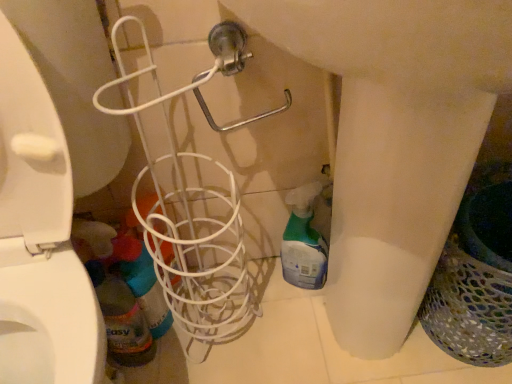
In order to face metallic silver shower at upper center, should I rotate leftwards or rightwards?

To face it directly, rotate left by 2.031 degrees.

The height and width of the screenshot is (384, 512). What are the coordinates of `metallic silver shower at upper center` in the screenshot? It's located at (197, 74).

Locate an element on the screen. The image size is (512, 384). multicolored mesh laundry basket at right is located at coordinates (475, 282).

Describe the element at coordinates (303, 241) in the screenshot. This screenshot has height=384, width=512. I see `translucent plastic spray bottle at lower center, which is the first cleaning product from right to left` at that location.

Locate an element on the screen. translucent plastic spray bottle at lower left, the 2th cleaning product when ordered from right to left is located at coordinates (141, 281).

Locate an element on the screen. Image resolution: width=512 pixels, height=384 pixels. white wire basket at center is located at coordinates (394, 139).

The image size is (512, 384). What are the coordinates of `metallic silver shower at upper center` in the screenshot? It's located at (197, 74).

Which object is more forward, white wire basket at center or translucent plastic bottle at lower left?

Positioned in front is white wire basket at center.

Could translucent plastic bottle at lower left be considered to be inside white wire basket at center?

No, white wire basket at center does not contain translucent plastic bottle at lower left.

Is translucent plastic bottle at lower left at the back of white wire basket at center?

That's not correct — white wire basket at center is not looking away from translucent plastic bottle at lower left.

Is white wire basket at center in contact with translucent plastic bottle at lower left?

No, white wire basket at center is not touching translucent plastic bottle at lower left.

Is translucent plastic bottle at lower left turned away from translucent plastic spray bottle at lower left, the 2th cleaning product when ordered from right to left?

Yes, translucent plastic spray bottle at lower left, the 2th cleaning product when ordered from right to left, is at the back of translucent plastic bottle at lower left.

Can you confirm if translucent plastic bottle at lower left is positioned to the right of translucent plastic spray bottle at lower left, the 2th cleaning product when ordered from right to left?

Incorrect, translucent plastic bottle at lower left is not on the right side of translucent plastic spray bottle at lower left, the 2th cleaning product when ordered from right to left.

Which object is wider, translucent plastic bottle at lower left or translucent plastic spray bottle at lower left, the 2th cleaning product when ordered from right to left?

Wider between the two is translucent plastic spray bottle at lower left, the 2th cleaning product when ordered from right to left.

From a real-world perspective, who is located higher, translucent plastic bottle at lower left or translucent plastic spray bottle at lower left, the 2th cleaning product when ordered from right to left?

From a 3D spatial view, translucent plastic bottle at lower left is above.

Which point is more distant from viewer, [110,334] or [413,12]?

The point [110,334] is more distant.

The width and height of the screenshot is (512, 384). Find the location of `sink above the translucent plastic bottle at lower left (from the image's perspective)`. sink above the translucent plastic bottle at lower left (from the image's perspective) is located at coordinates (394, 139).

Is translucent plastic bottle at lower left directly adjacent to white wire basket at center?

translucent plastic bottle at lower left and white wire basket at center are clearly separated.

Considering the sizes of objects translucent plastic bottle at lower left and white wire basket at center in the image provided, who is wider, translucent plastic bottle at lower left or white wire basket at center?

white wire basket at center is wider.

Between translucent plastic bottle at lower left and multicolored mesh laundry basket at right, which one has larger size?

multicolored mesh laundry basket at right is bigger.

Is translucent plastic bottle at lower left wider or thinner than multicolored mesh laundry basket at right?

Clearly, translucent plastic bottle at lower left has less width compared to multicolored mesh laundry basket at right.

Identify the location of laundry basket that appears in front of the translucent plastic bottle at lower left. [x=475, y=282].

In the scene shown: From the image's perspective, is translucent plastic bottle at lower left on multicolored mesh laundry basket at right?

No, from the image's perspective, translucent plastic bottle at lower left is not on top of multicolored mesh laundry basket at right.

In the image, is white wire basket at center on the left side or the right side of multicolored mesh laundry basket at right?

Based on their positions, white wire basket at center is located to the left of multicolored mesh laundry basket at right.

Is the surface of white wire basket at center in direct contact with multicolored mesh laundry basket at right?

No, white wire basket at center is not in contact with multicolored mesh laundry basket at right.

Which object is thinner, white wire basket at center or multicolored mesh laundry basket at right?

With smaller width is multicolored mesh laundry basket at right.

Find the location of `sink above the multicolored mesh laundry basket at right (from a real-world perspective)`. sink above the multicolored mesh laundry basket at right (from a real-world perspective) is located at coordinates (394, 139).

From the image's perspective, is translucent plastic spray bottle at lower left, the 1th cleaning product in the left-to-right sequence, positioned above or below translucent plastic bottle at lower left?

translucent plastic spray bottle at lower left, the 1th cleaning product in the left-to-right sequence, is above translucent plastic bottle at lower left.

Which of these two, translucent plastic spray bottle at lower left, the 1th cleaning product in the left-to-right sequence, or translucent plastic bottle at lower left, is smaller?

translucent plastic bottle at lower left is smaller.

Considering the positions of points (120, 239) and (112, 355), is point (120, 239) closer to camera compared to point (112, 355)?

Yes, point (120, 239) is closer to viewer.

Is the surface of translucent plastic spray bottle at lower left, the 1th cleaning product in the left-to-right sequence, in direct contact with translucent plastic bottle at lower left?

Yes, translucent plastic spray bottle at lower left, the 1th cleaning product in the left-to-right sequence, is beside translucent plastic bottle at lower left.

Is metallic silver shower at upper center at the left side of multicolored mesh laundry basket at right?

Correct, you'll find metallic silver shower at upper center to the left of multicolored mesh laundry basket at right.

The image size is (512, 384). What are the coordinates of `shower above the multicolored mesh laundry basket at right (from a real-world perspective)` in the screenshot? It's located at (197, 74).

Is metallic silver shower at upper center wider or thinner than multicolored mesh laundry basket at right?

metallic silver shower at upper center is thinner than multicolored mesh laundry basket at right.

Find the location of a particular element. This screenshot has height=384, width=512. sink that appears above the translucent plastic bottle at lower left (from a real-world perspective) is located at coordinates (394, 139).

I want to click on bottle below the translucent plastic spray bottle at lower left, the 2th cleaning product when ordered from right to left (from the image's perspective), so click(x=121, y=318).

Estimate the real-world distances between objects in this image. Which object is closer to white wire basket at center, translucent plastic spray bottle at lower center, arranged as the 2th cleaning product when viewed from the left, or metallic silver shower at upper center?

metallic silver shower at upper center.

Considering their positions, is white wire basket at center positioned closer to translucent plastic spray bottle at lower center, which is the first cleaning product from right to left, than translucent plastic spray bottle at lower left, the 2th cleaning product when ordered from right to left?

white wire basket at center lies closer to translucent plastic spray bottle at lower center, which is the first cleaning product from right to left, than the other object.

Based on their spatial positions, is metallic silver shower at upper center or white wire basket at center closer to translucent plastic spray bottle at lower left, the 1th cleaning product in the left-to-right sequence?

metallic silver shower at upper center.

Consider the image. Based on their spatial positions, is multicolored mesh laundry basket at right or translucent plastic spray bottle at lower left, the 1th cleaning product in the left-to-right sequence, further from metallic silver shower at upper center?

Based on the image, multicolored mesh laundry basket at right appears to be further to metallic silver shower at upper center.

From the image, which object appears to be farther from translucent plastic spray bottle at lower center, arranged as the 2th cleaning product when viewed from the left, metallic silver shower at upper center or translucent plastic spray bottle at lower left, the 1th cleaning product in the left-to-right sequence?

metallic silver shower at upper center is further to translucent plastic spray bottle at lower center, arranged as the 2th cleaning product when viewed from the left.

When comparing their distances from translucent plastic spray bottle at lower left, the 2th cleaning product when ordered from right to left, does translucent plastic spray bottle at lower center, which is the first cleaning product from right to left, or white wire basket at center seem further?

white wire basket at center is positioned further to the anchor translucent plastic spray bottle at lower left, the 2th cleaning product when ordered from right to left.

Based on their spatial positions, is translucent plastic bottle at lower left or white wire basket at center further from translucent plastic spray bottle at lower left, the 1th cleaning product in the left-to-right sequence?

Among the two, white wire basket at center is located further to translucent plastic spray bottle at lower left, the 1th cleaning product in the left-to-right sequence.

Looking at the image, which one is located further to translucent plastic spray bottle at lower center, which is the first cleaning product from right to left, multicolored mesh laundry basket at right or metallic silver shower at upper center?

metallic silver shower at upper center lies further to translucent plastic spray bottle at lower center, which is the first cleaning product from right to left, than the other object.

The height and width of the screenshot is (384, 512). In order to click on shower between translucent plastic spray bottle at lower left, the 1th cleaning product in the left-to-right sequence, and multicolored mesh laundry basket at right, in the horizontal direction in this screenshot , I will do `click(197, 74)`.

Find the location of a particular element. This screenshot has width=512, height=384. laundry basket between white wire basket at center and translucent plastic spray bottle at lower center, which is the first cleaning product from right to left, in the front-back direction is located at coordinates (475, 282).

I want to click on shower between white wire basket at center and translucent plastic spray bottle at lower center, which is the first cleaning product from right to left, in the front-back direction, so click(197, 74).

Where is `shower between translucent plastic bottle at lower left and multicolored mesh laundry basket at right`? Image resolution: width=512 pixels, height=384 pixels. shower between translucent plastic bottle at lower left and multicolored mesh laundry basket at right is located at coordinates (197, 74).